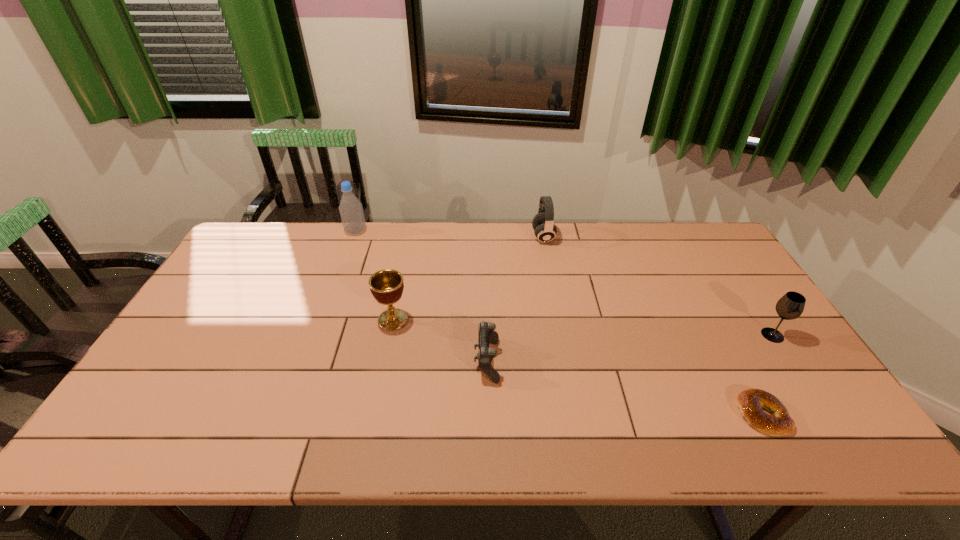
Locate an element on the screen. Image resolution: width=960 pixels, height=540 pixels. blank space at the far right corner is located at coordinates (676, 236).

This screenshot has height=540, width=960. I want to click on free area in between the third object from right to left and the second object from left to right, so click(468, 278).

At what (x,y) coordinates should I click in order to perform the action: click on free space between the rightmost object and the fifth object from right to left. Please return your answer as a coordinate pair (x, y). Looking at the image, I should click on (583, 327).

Locate an element on the screen. The width and height of the screenshot is (960, 540). unoccupied area between the control and the wineglass is located at coordinates (630, 348).

Where is `unoccupied area between the wineglass and the shortest object`? The width and height of the screenshot is (960, 540). unoccupied area between the wineglass and the shortest object is located at coordinates click(767, 375).

I want to click on vacant area that lies between the bagel and the bottle, so click(559, 323).

Identify the location of vacant space in between the headset and the leftmost object. The height and width of the screenshot is (540, 960). (449, 234).

Locate an element on the screen. Image resolution: width=960 pixels, height=540 pixels. vacant space that is in between the headset and the nearest object is located at coordinates (653, 326).

The width and height of the screenshot is (960, 540). In order to click on vacant space that's between the bagel and the rightmost object in this screenshot , I will do `click(767, 375)`.

The height and width of the screenshot is (540, 960). Find the location of `empty location between the fourth object from left to right and the chalice`. empty location between the fourth object from left to right and the chalice is located at coordinates (468, 278).